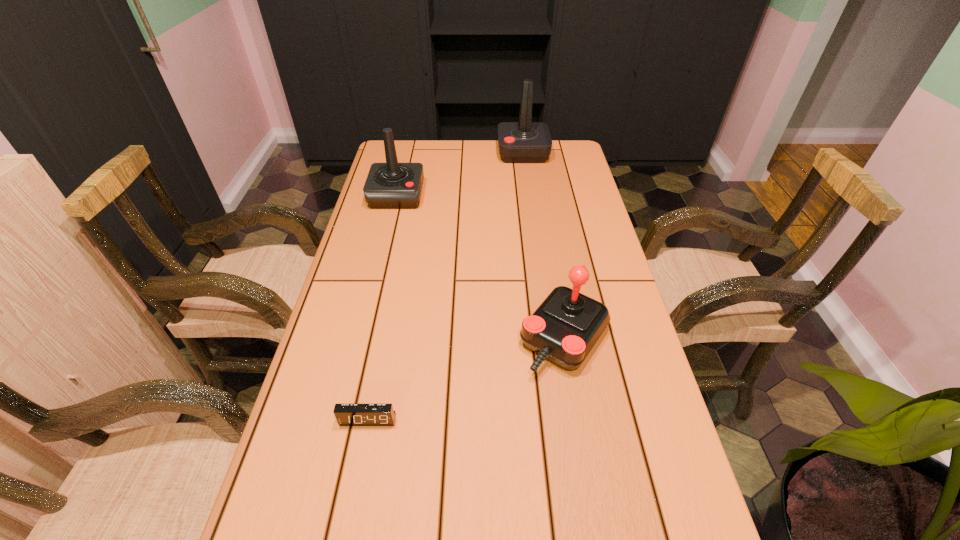
Identify the location of the farthest object. (525, 141).

Image resolution: width=960 pixels, height=540 pixels. I want to click on the third nearest object, so click(x=391, y=185).

The width and height of the screenshot is (960, 540). Identify the location of the second nearest joystick. (391, 185).

I want to click on the second nearest object, so click(564, 328).

Where is `alarm clock`? alarm clock is located at coordinates (346, 414).

At what (x,y) coordinates should I click in order to perform the action: click on the shortest object. Please return your answer as a coordinate pair (x, y). Looking at the image, I should click on (346, 414).

This screenshot has height=540, width=960. In order to click on vacant region located on the left of the farthest object in this screenshot , I will do `click(474, 153)`.

The width and height of the screenshot is (960, 540). Identify the location of vacant space situated 0.310m on the front-facing side of the leftmost joystick. [377, 277].

Identify the location of vacant space located on the back of the third farthest object. The image size is (960, 540). (554, 280).

What are the coordinates of `free spot located on the front-facing side of the nearest object` in the screenshot? It's located at (348, 524).